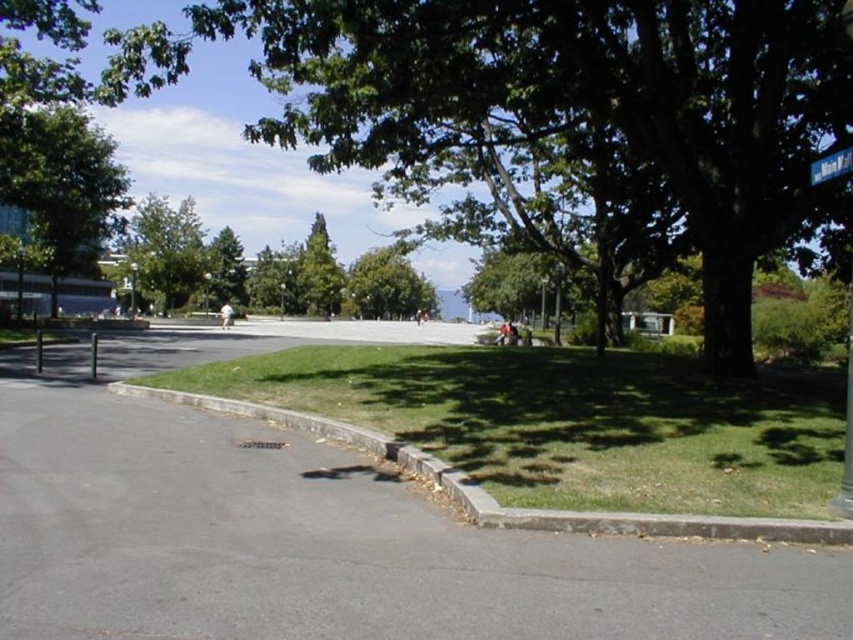
Between point (422, 362) and point (19, 246), which one is positioned in front?

Point (422, 362) is in front.

Image resolution: width=853 pixels, height=640 pixels. I want to click on green grass at lower center, so click(x=570, y=420).

Locate an element on the screen. The height and width of the screenshot is (640, 853). green grass at lower center is located at coordinates (570, 420).

Is green leafy tree at upper left positioned in front of green leafy tree at center?

No, it is behind green leafy tree at center.

Who is taller, green leafy tree at upper left or green leafy tree at center?

green leafy tree at upper left

Between point (148, 230) and point (398, 275), which one is positioned in front?

Point (148, 230)

This screenshot has height=640, width=853. In order to click on green leafy tree at upper left in this screenshot , I will do `click(166, 250)`.

Between blue plastic street sign at upper right and metallic pole at center, which one is positioned higher?

blue plastic street sign at upper right is above.

Which of these two, blue plastic street sign at upper right or metallic pole at center, stands shorter?

blue plastic street sign at upper right

Between point (811, 168) and point (131, 275), which one is positioned behind?

Positioned behind is point (131, 275).

The image size is (853, 640). Identify the location of blue plastic street sign at upper right. (831, 164).